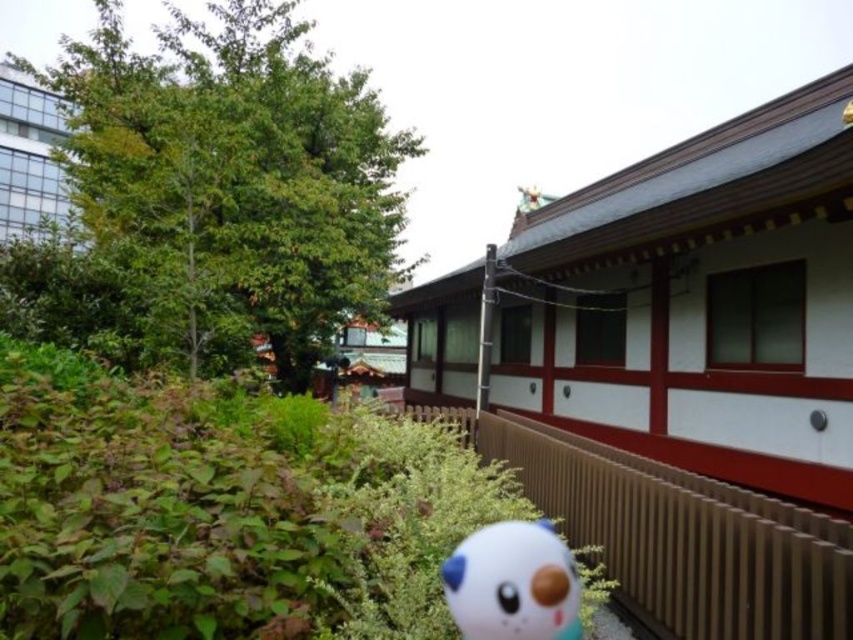
Question: Which object is farther from the camera taking this photo?

Choices:
 (A) white glossy plush at lower center
 (B) brown wooden rail at lower right

Answer: (B)

Question: Can you confirm if brown wooden rail at lower right is bigger than white glossy plush at lower center?

Choices:
 (A) yes
 (B) no

Answer: (A)

Question: Can you confirm if brown wooden rail at lower right is smaller than white glossy plush at lower center?

Choices:
 (A) yes
 (B) no

Answer: (B)

Question: Is brown wooden rail at lower right further to camera compared to white glossy plush at lower center?

Choices:
 (A) no
 (B) yes

Answer: (B)

Question: Which of the following is the farthest from the observer?

Choices:
 (A) (521, 572)
 (B) (772, 516)

Answer: (B)

Question: Which of the following is the farthest from the observer?

Choices:
 (A) (502, 540)
 (B) (619, 461)

Answer: (B)